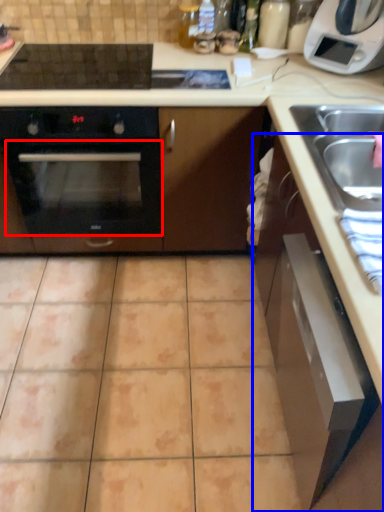
Question: Which object appears farthest to the camera in this image, oven (highlighted by a red box) or cabinetry (highlighted by a blue box)?

Choices:
 (A) oven
 (B) cabinetry

Answer: (A)